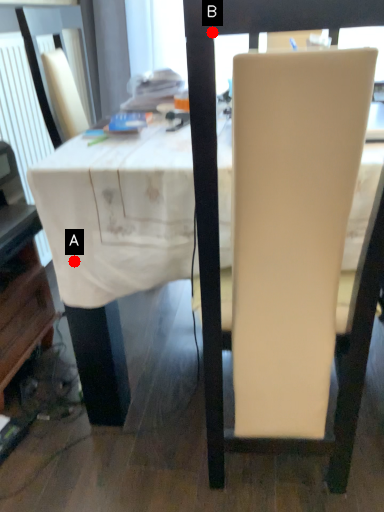
Question: Two points are circled on the image, labeled by A and B beside each circle. Which point is farther to the camera?

Choices:
 (A) A is further
 (B) B is further

Answer: (A)